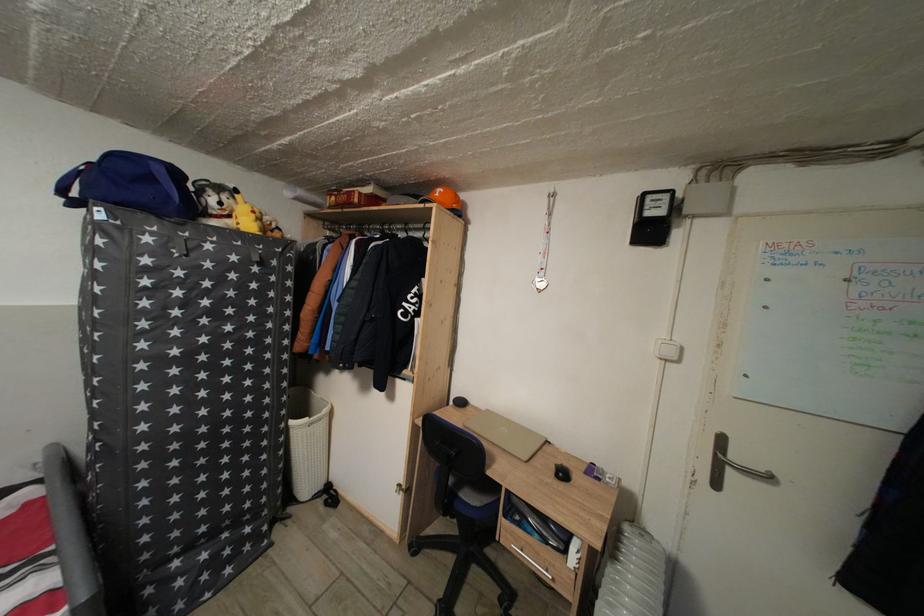
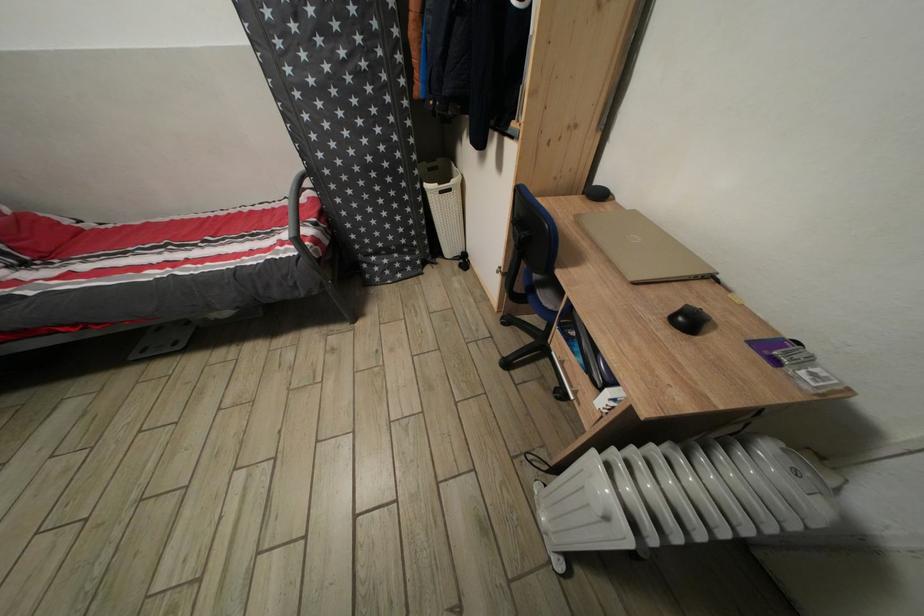
Where in the second image is the point corresponding to (x=493, y=416) from the first image?

(641, 217)